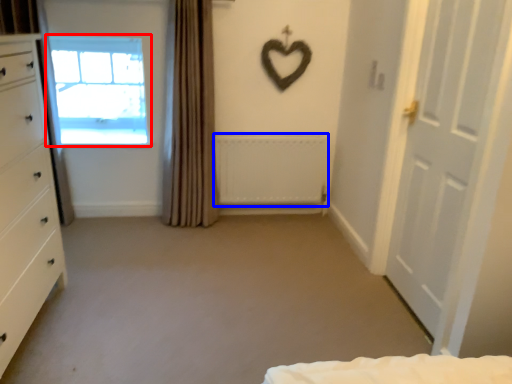
Question: Which point is further to the camera, window (highlighted by a red box) or radiator (highlighted by a blue box)?

Choices:
 (A) window
 (B) radiator

Answer: (A)